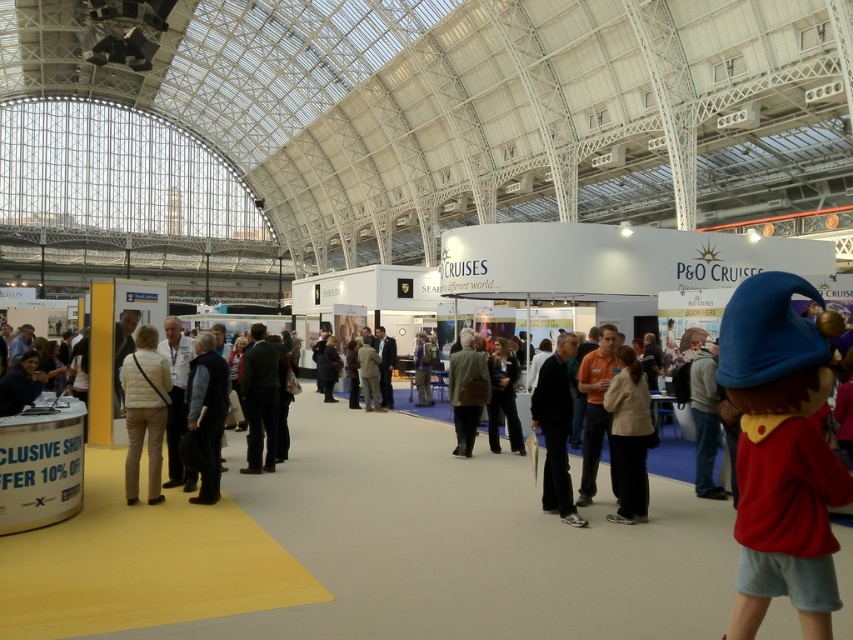
Question: Observing the image, what is the correct spatial positioning of dark gray sweater at center in reference to orange shirt at center?

Choices:
 (A) below
 (B) above

Answer: (B)

Question: Among these points, which one is farthest from the camera?

Choices:
 (A) (601, 336)
 (B) (575, 515)
 (C) (416, 337)

Answer: (C)

Question: Which point is closer to the camera?

Choices:
 (A) dark green fabric jacket at center
 (B) dark gray sweater at center

Answer: (B)

Question: Which of these objects is positioned farthest from the dark gray suit at center?

Choices:
 (A) orange shirt at center
 (B) light beige quilted jacket at center

Answer: (B)

Question: Does red plush toy at lower right have a smaller size compared to light beige quilted jacket at center?

Choices:
 (A) no
 (B) yes

Answer: (A)

Question: Does black fabric pants at center appear on the left side of orange shirt at center?

Choices:
 (A) yes
 (B) no

Answer: (A)